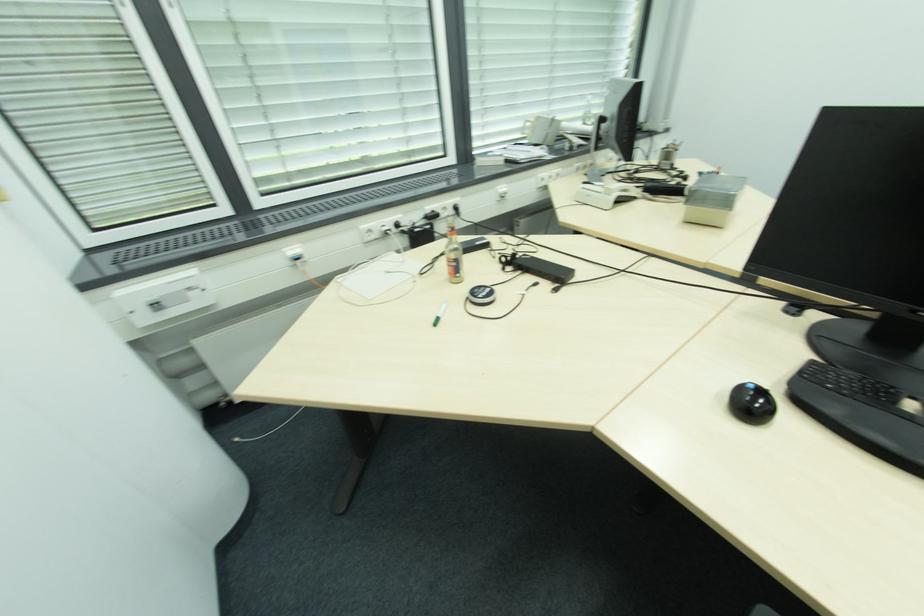
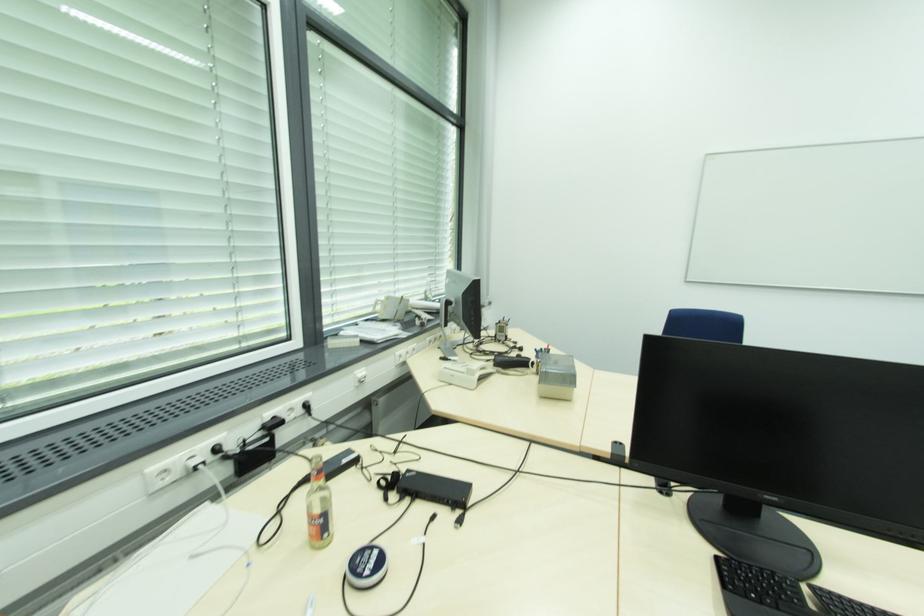
In the second image, find the point that corresponds to pixel 372 232 in the first image.

(167, 472)